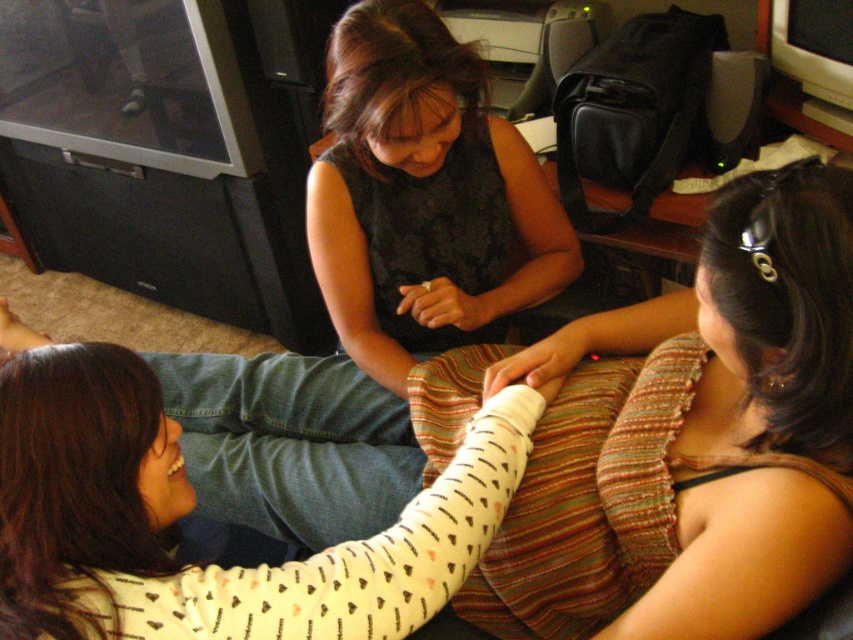
You are a photographer standing in the living room. You want to take a photo of both the dark textured blouse at center and the black matte dress at center. Which one will appear larger in the photo?

The dark textured blouse at center will appear larger in the photo because it is closer to the viewer than the black matte dress at center.